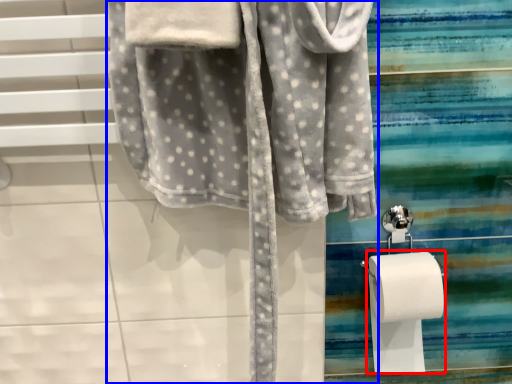
Question: Among these objects, which one is nearest to the camera, toilet paper (highlighted by a red box) or towel (highlighted by a blue box)?

Choices:
 (A) toilet paper
 (B) towel

Answer: (B)